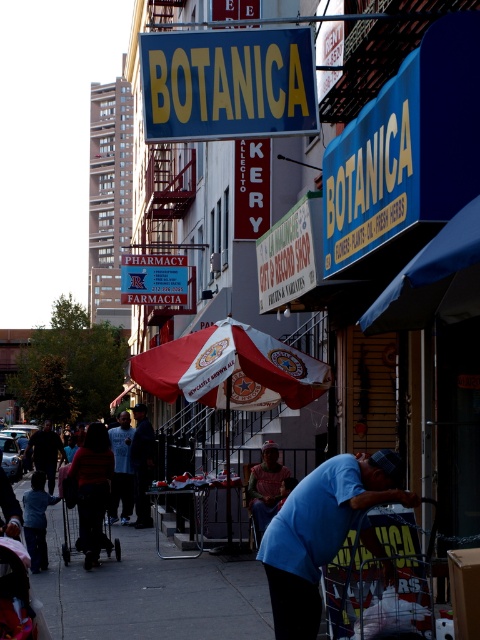
You are standing on the bustling urban street scene and want to find the exact location of the white fabric umbrella at center. According to the coordinates given, where would you look?

The white fabric umbrella at center is located at coordinates point (230, 369).

You are standing at the center of the street and see a white fabric umbrella at center and blue denim jeans at center. If you want to pick up both items, which one should you reach for first to minimize your movement?

The white fabric umbrella at center is 4.26 meters away from blue denim jeans at center. Since both items are at the center, you can reach either one first as they are equidistant from your current position.